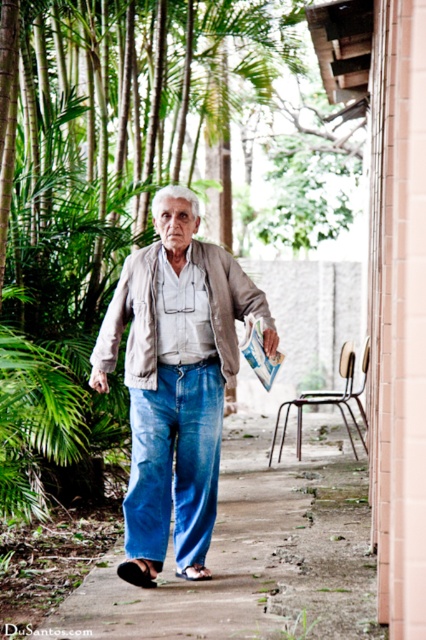
You are a fashion designer analyzing clothing items in the scene. The blue denim pants at center and the black leather sandal at lower left are part of the man s outfit. Which clothing item is bigger in size?

The blue denim pants at center has a larger size compared to the black leather sandal at lower left, so the blue denim pants at center is bigger in size.